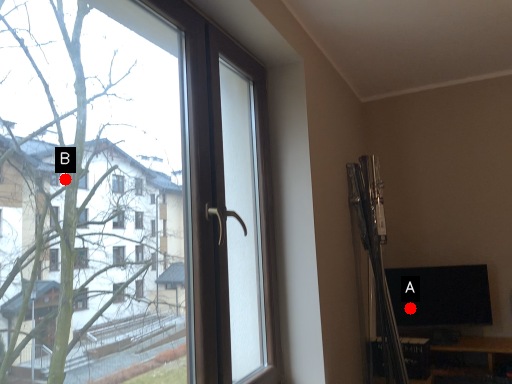
Question: Two points are circled on the image, labeled by A and B beside each circle. Which point appears farthest from the camera in this image?

Choices:
 (A) A is further
 (B) B is further

Answer: (A)